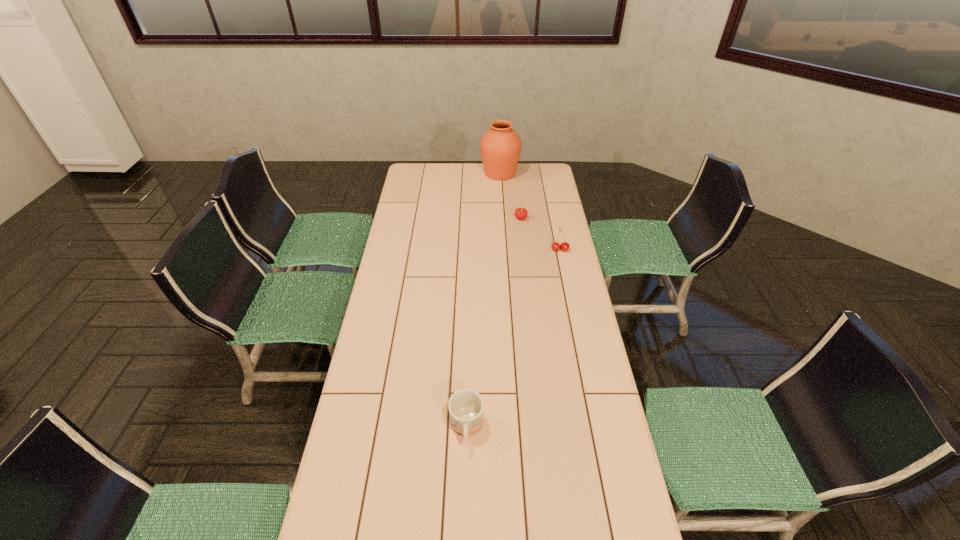
Find the location of a particular element. vacant point located on the side with the handle of the mug is located at coordinates [465, 497].

The height and width of the screenshot is (540, 960). Identify the location of object present at the far edge. (500, 146).

Where is `object at the right edge`? object at the right edge is located at coordinates (555, 246).

Image resolution: width=960 pixels, height=540 pixels. What are the coordinates of `free space at the far edge of the desktop` in the screenshot? It's located at (470, 176).

You are a GUI agent. You are given a task and a screenshot of the screen. Output one action in this format:
    pyautogui.click(x=<x>, y=<y>)
    Task: Click on the vacant area at the left edge
    The width and height of the screenshot is (960, 540).
    Given the screenshot: What is the action you would take?
    pyautogui.click(x=358, y=414)

Identify the location of free space at the right edge of the desktop. The height and width of the screenshot is (540, 960). (564, 231).

Locate an element on the screen. The height and width of the screenshot is (540, 960). vacant region between the second nearest object and the farthest object is located at coordinates (530, 212).

This screenshot has width=960, height=540. I want to click on vacant space in between the rightmost object and the farthest object, so click(x=530, y=212).

Where is `free spot between the nearest object and the rightmost object`? free spot between the nearest object and the rightmost object is located at coordinates (514, 339).

Image resolution: width=960 pixels, height=540 pixels. I want to click on unoccupied area between the right cherry and the nearest object, so click(x=514, y=339).